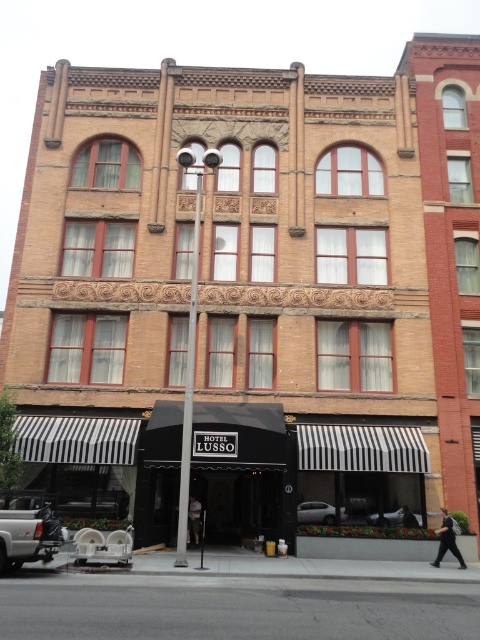
You are a delivery person needing to park your 2.5 meter wide van. You see a white matte sedan at center and a dark gray fabric jacket at center. Can you determine if there is enough space between them to park your van?

The white matte sedan at center might be wider than dark gray fabric jacket at center, so it is uncertain if there is enough space between them to park a 2.5 meter wide van. You should check the actual width before deciding.

In the scene shown: You are a customer entering the building and see both the black smooth jacket at lower right and the dark gray fabric jacket at center. Which jacket is wider?

The black smooth jacket at lower right is wider than the dark gray fabric jacket at center.

You are standing at the entrance of the building and looking towards the street. Where is the silver metallic truck at lower left located relative to your position?

The silver metallic truck at lower left is located at point (28, 536) relative to your position.